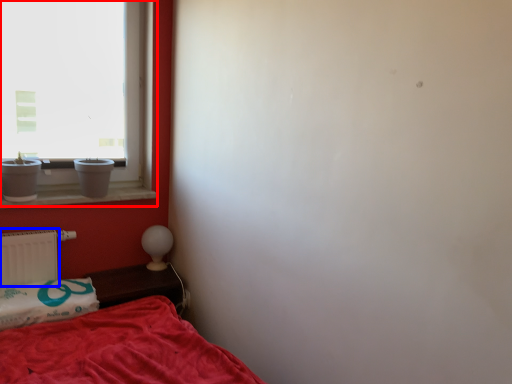
Question: Which point is closer to the camera, window (highlighted by a red box) or radiator (highlighted by a blue box)?

Choices:
 (A) window
 (B) radiator

Answer: (A)